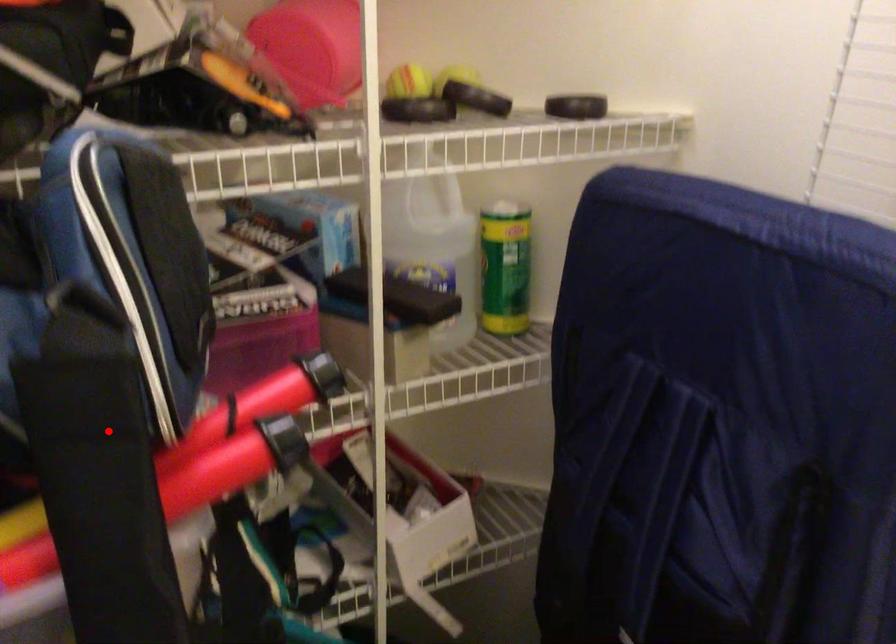
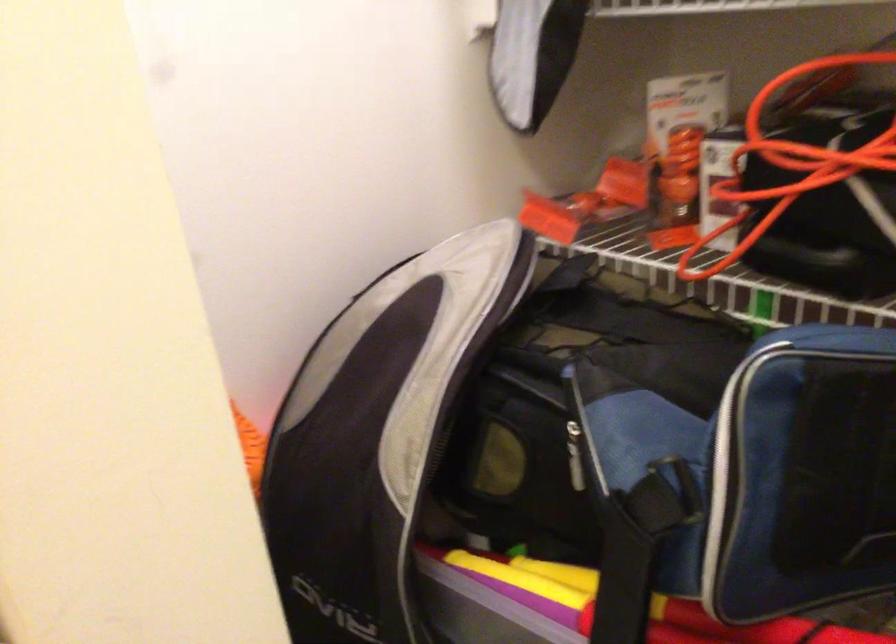
The point at the highlighted location is marked in the first image. Where is the corresponding point in the second image?

(622, 581)